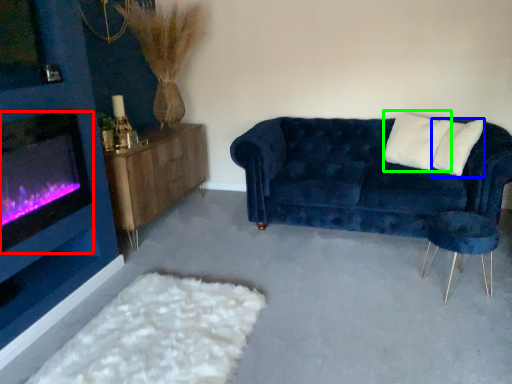
Question: Considering the real-world distances, which object is closest to wood burning stove (highlighted by a red box)? pillow (highlighted by a blue box) or pillow (highlighted by a green box).

Choices:
 (A) pillow
 (B) pillow

Answer: (B)